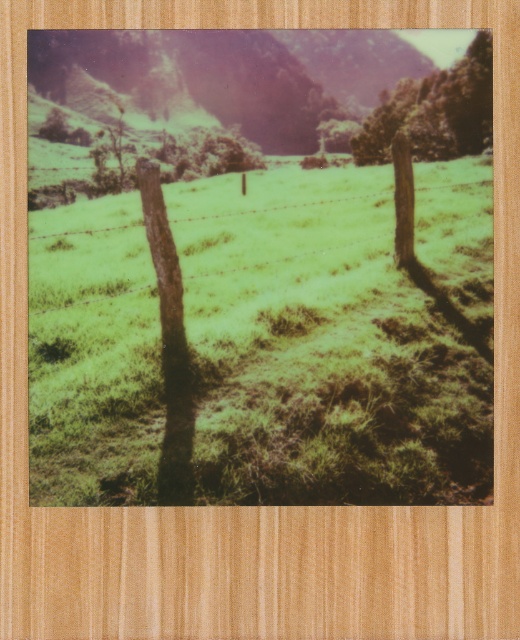
You are a photographer trying to capture the entire scene in a single shot. Given that the green grassy at center and the green leafy tree at upper center are both in your viewfinder, which object would require you to adjust your camera angle to include its full width?

The green leafy tree at upper center has a greater width than the green grassy at center, so you would need to adjust your camera angle to include its full width.

You are a photographer trying to capture the green grassy at center and the green leafy tree at upper center in a single shot. Based on their positions, which one would appear closer to the camera?

The green grassy at center appears closer to the camera because it is located below the green leafy tree at upper center, indicating it is in the foreground.

Based on the scene described, which object takes up more area in the image? Please choose between the green grassy at center and the green leafy tree at upper center.

The green leafy tree at upper center occupies more space than the green grassy at center in the image.